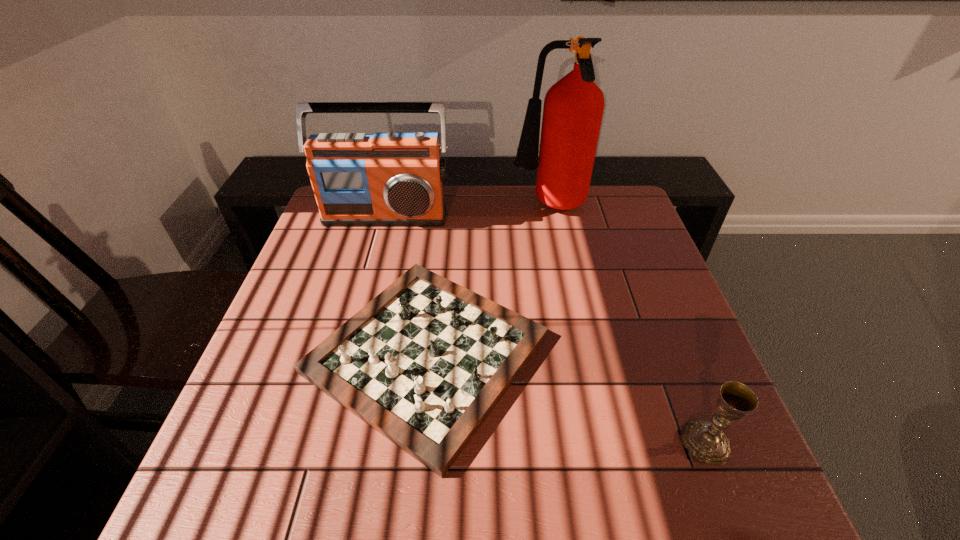
Where is `free space located 0.080m on the back of the chessboard`? The image size is (960, 540). free space located 0.080m on the back of the chessboard is located at coordinates (438, 253).

Image resolution: width=960 pixels, height=540 pixels. Find the location of `fire extinguisher that is at the far edge`. fire extinguisher that is at the far edge is located at coordinates (573, 108).

Locate an element on the screen. The image size is (960, 540). radio receiver that is at the far edge is located at coordinates (383, 179).

The width and height of the screenshot is (960, 540). Identify the location of chalice present at the near edge. pos(705,440).

The width and height of the screenshot is (960, 540). What are the coordinates of `chessboard at the near edge` in the screenshot? It's located at pos(424,363).

The height and width of the screenshot is (540, 960). Identify the location of radio receiver at the left edge. (383, 179).

Where is `chessboard that is at the left edge`? This screenshot has height=540, width=960. chessboard that is at the left edge is located at coordinates (424, 363).

At what (x,y) coordinates should I click in order to perform the action: click on fire extinguisher that is at the right edge. Please return your answer as a coordinate pair (x, y). The height and width of the screenshot is (540, 960). Looking at the image, I should click on (573, 108).

Find the location of a particular element. chalice located in the right edge section of the desktop is located at coordinates (705, 440).

Locate an element on the screen. The height and width of the screenshot is (540, 960). object positioned at the far left corner is located at coordinates (383, 179).